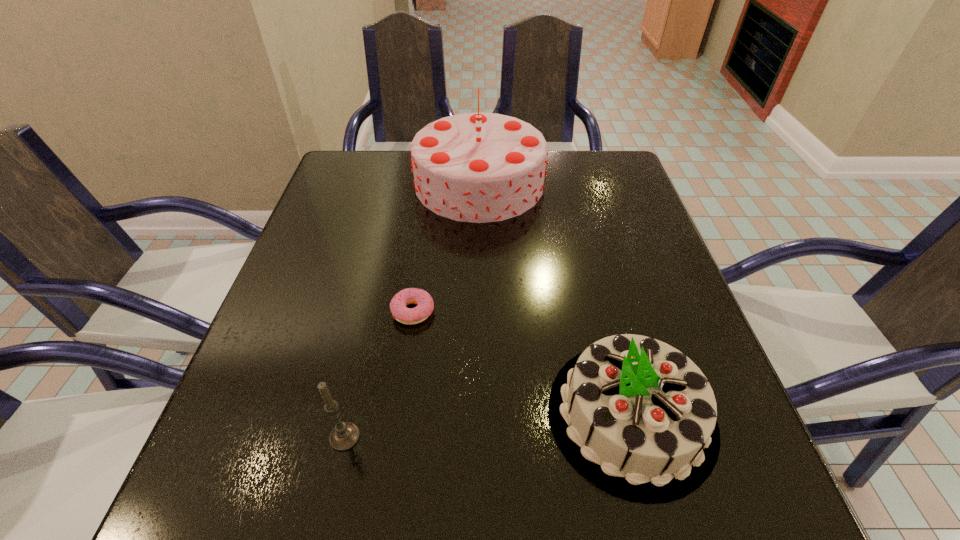
Identify the location of the tallest object. The width and height of the screenshot is (960, 540). (478, 167).

Locate an element on the screen. The width and height of the screenshot is (960, 540). the farther birthday cake is located at coordinates (478, 167).

Find the location of `the nearer birthday cake`. the nearer birthday cake is located at coordinates (637, 417).

Locate an element on the screen. Image resolution: width=960 pixels, height=540 pixels. the leftmost object is located at coordinates pos(345,435).

You are a GUI agent. You are given a task and a screenshot of the screen. Output one action in this format:
    pyautogui.click(x=<x>, y=<y>)
    Task: Click on the candle
    This screenshot has width=960, height=540.
    Given the screenshot: What is the action you would take?
    pyautogui.click(x=345, y=435)

I want to click on the shortest object, so click(x=425, y=305).

Image resolution: width=960 pixels, height=540 pixels. Identify the location of the third nearest object. (425, 305).

What are the coordinates of `free spot located on the front of the farther birthday cake` in the screenshot? It's located at (478, 320).

You are a GUI agent. You are given a task and a screenshot of the screen. Output one action in this format:
    pyautogui.click(x=<x>, y=<y>)
    Task: Click on the vacant area located 0.080m on the back of the shorter birthday cake
    Image resolution: width=960 pixels, height=540 pixels.
    Given the screenshot: What is the action you would take?
    pyautogui.click(x=605, y=314)

The height and width of the screenshot is (540, 960). Find the location of `vacant region located on the right of the candle`. vacant region located on the right of the candle is located at coordinates (458, 437).